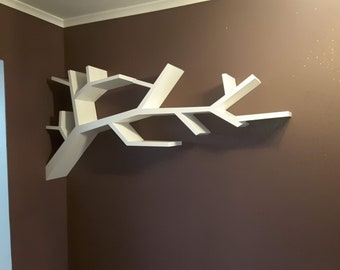
I want to click on shelf, so click(x=113, y=71), click(x=113, y=101), click(x=161, y=132), click(x=180, y=95), click(x=279, y=112), click(x=81, y=78).